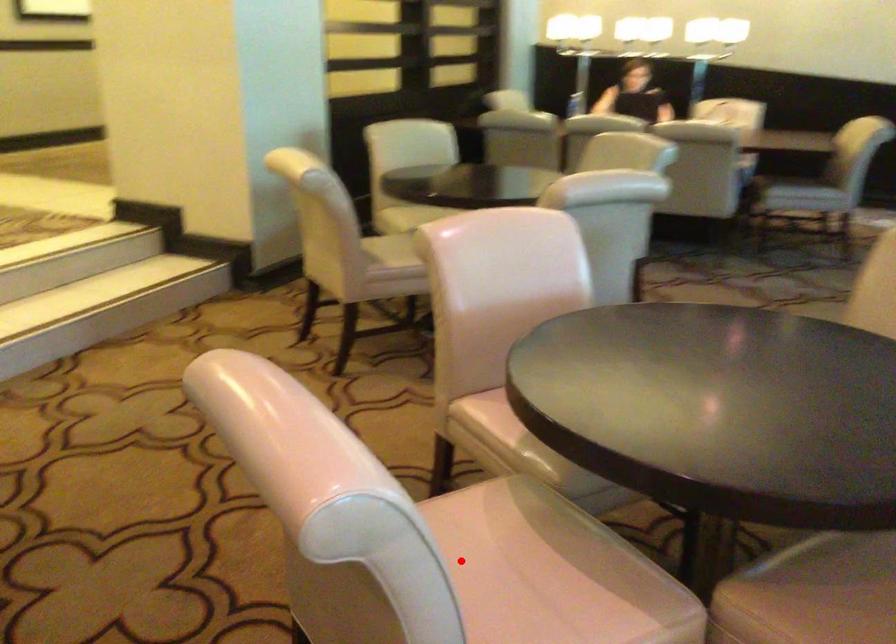
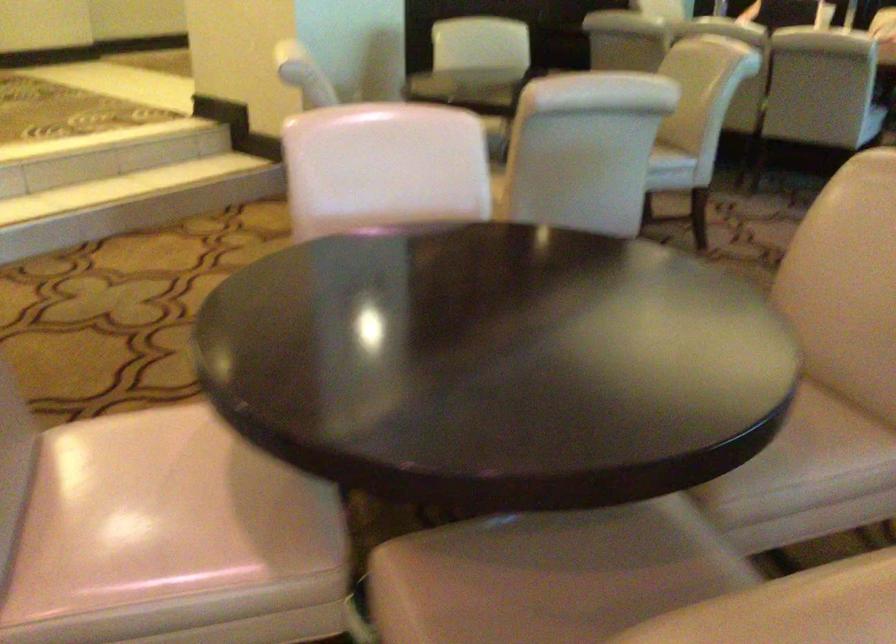
Locate, in the second image, the point that corresponds to the highlighted location in the first image.

(135, 476)